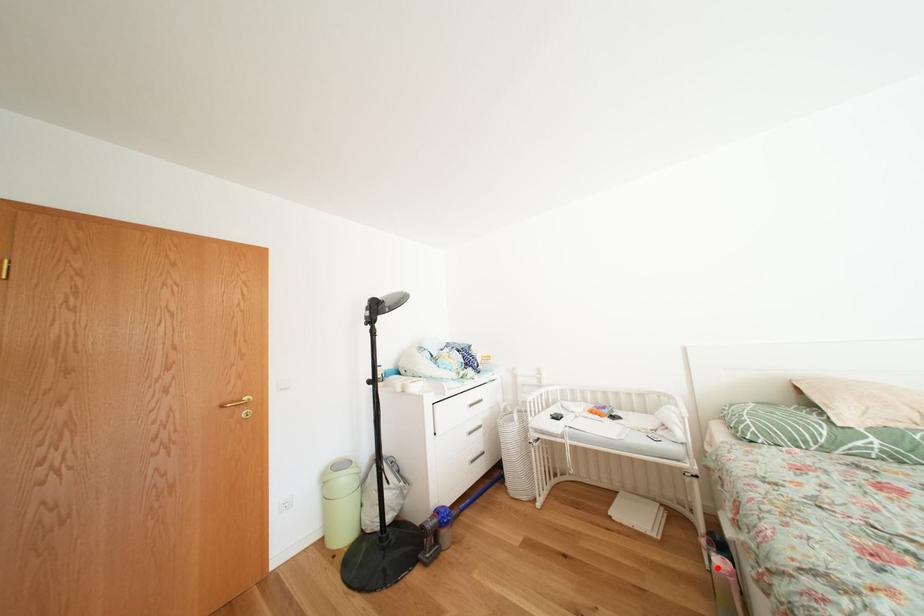
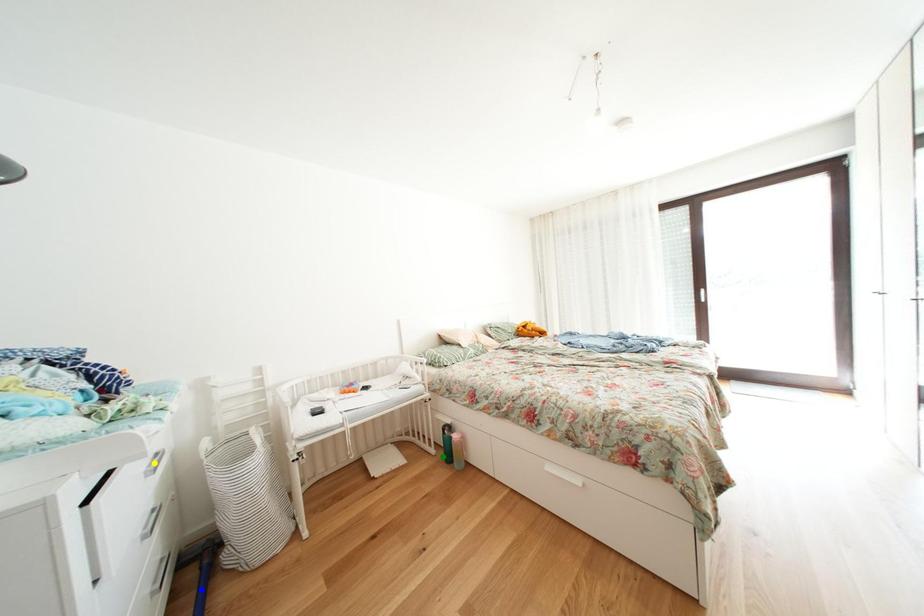
Question: I am providing you with two images of the same scene from different viewpoints. A red point is marked on the first image. You are given multiple points on the second image. Which point in image 2 is actually the same real-world point as the red point in image 1?

Choices:
 (A) yellow point
 (B) blue point
 (C) green point

Answer: (C)